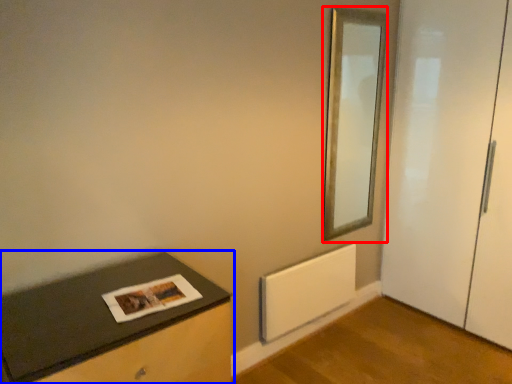
Question: Which object is closer to the camera taking this photo, mirror (highlighted by a red box) or table (highlighted by a blue box)?

Choices:
 (A) mirror
 (B) table

Answer: (B)